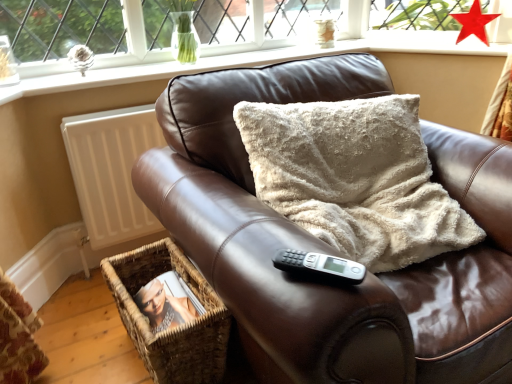
Question: From the image's perspective, is brown leather couch at center on top of black plastic remote at center?

Choices:
 (A) yes
 (B) no

Answer: (A)

Question: Is brown leather couch at center next to black plastic remote at center?

Choices:
 (A) no
 (B) yes

Answer: (A)

Question: Is brown leather couch at center oriented away from black plastic remote at center?

Choices:
 (A) yes
 (B) no

Answer: (B)

Question: From a real-world perspective, is brown leather couch at center physically below black plastic remote at center?

Choices:
 (A) no
 (B) yes

Answer: (B)

Question: Can you confirm if brown leather couch at center is shorter than black plastic remote at center?

Choices:
 (A) no
 (B) yes

Answer: (A)

Question: Is brown leather couch at center at the left side of black plastic remote at center?

Choices:
 (A) yes
 (B) no

Answer: (B)

Question: Is the depth of red glass star at upper right less than that of woven brown basket at lower left?

Choices:
 (A) no
 (B) yes

Answer: (A)

Question: Is woven brown basket at lower left completely or partially inside red glass star at upper right?

Choices:
 (A) no
 (B) yes

Answer: (A)

Question: Does red glass star at upper right have a smaller size compared to woven brown basket at lower left?

Choices:
 (A) yes
 (B) no

Answer: (A)

Question: Is red glass star at upper right at the left side of woven brown basket at lower left?

Choices:
 (A) yes
 (B) no

Answer: (B)

Question: From the image's perspective, is red glass star at upper right located above woven brown basket at lower left?

Choices:
 (A) yes
 (B) no

Answer: (A)

Question: Does red glass star at upper right have a lesser height compared to woven brown basket at lower left?

Choices:
 (A) no
 (B) yes

Answer: (B)

Question: Is brown leather couch at center smaller than smooth white surface at upper center?

Choices:
 (A) no
 (B) yes

Answer: (A)